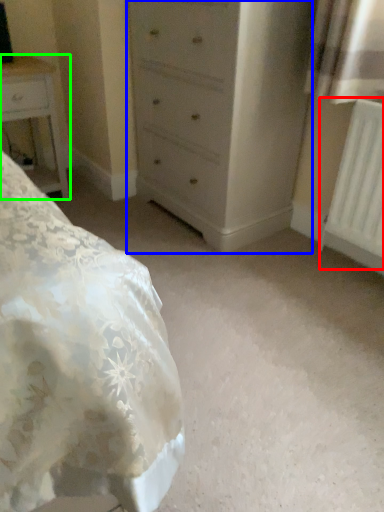
Question: Based on their relative distances, which object is farther from radiator (highlighted by a red box)? Choose from chest of drawers (highlighted by a blue box) and nightstand (highlighted by a green box).

Choices:
 (A) chest of drawers
 (B) nightstand

Answer: (B)